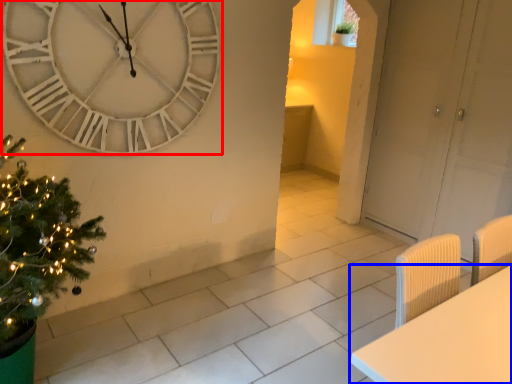
Question: Which object appears farthest to the camera in this image, wall clock (highlighted by a red box) or furniture (highlighted by a blue box)?

Choices:
 (A) wall clock
 (B) furniture

Answer: (A)